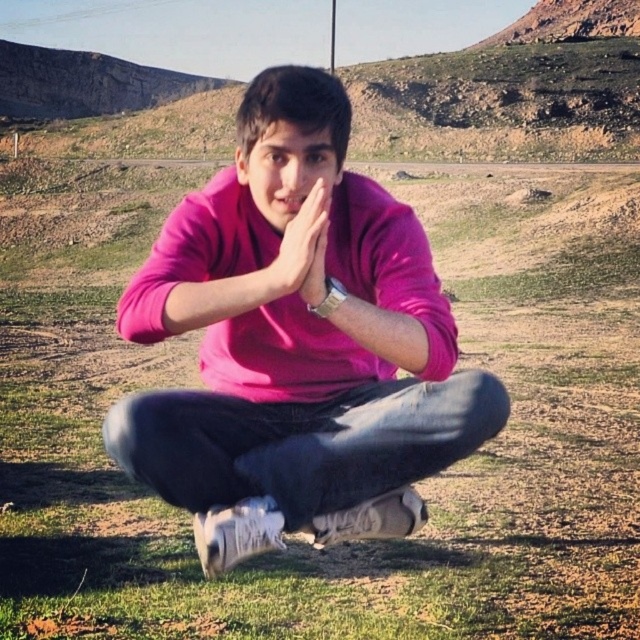
You are planning to lay a picnic blanket on the grassy area where the green grass at center and pink matte sweater at center are located. Which object occupies more horizontal space in the image?

The green grass at center occupies more horizontal space than the pink matte sweater at center because its width surpasses the sweater.

You are a photographer planning to take a portrait of the person in the scene. To ensure the subject stands out against the background, you need to consider the height difference between the green grass at center and the pink matte hands at center. Which object should be placed in the foreground to create a contrast?

The green grass at center is taller than the pink matte hands at center. To create contrast, place the green grass at center in the foreground as it is taller and will stand out more against the background.

You are trying to determine if the pink matte sweater at center can fit into a box designed for the pink matte hands at center. Based on their sizes, will the sweater fit?

The pink matte sweater at center is wider than the pink matte hands at center, so it might not fit into a box designed for the hands.